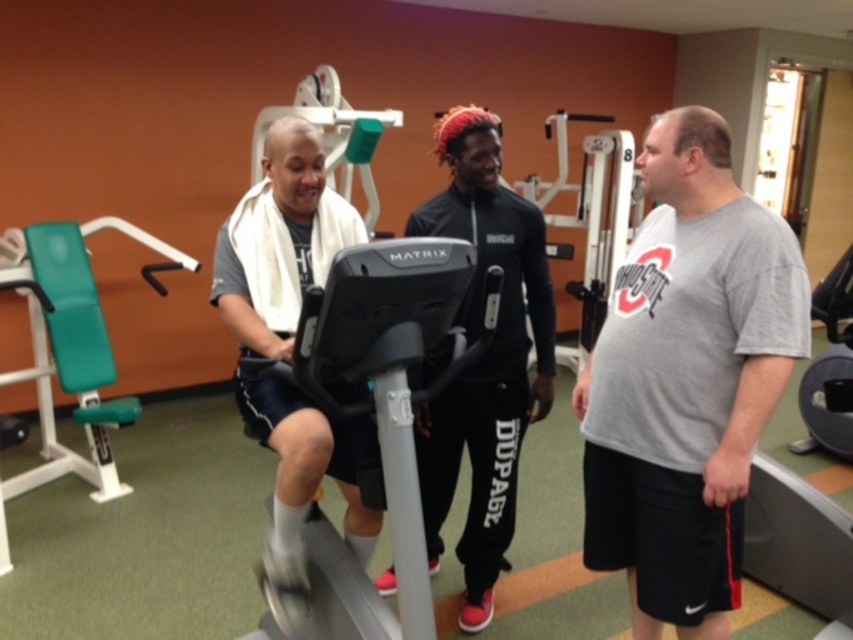
Can you confirm if black plastic elliptical at center is positioned to the left of gray matte/soft exercise bike at center?

Incorrect, black plastic elliptical at center is not on the left side of gray matte/soft exercise bike at center.

Does black plastic elliptical at center have a larger size compared to gray matte/soft exercise bike at center?

Yes, black plastic elliptical at center is bigger than gray matte/soft exercise bike at center.

Is point (445, 316) behind point (242, 317)?

No.

The image size is (853, 640). In order to click on black plastic elliptical at center in this screenshot , I will do `click(376, 412)`.

Does black plastic elliptical at center appear over black matte track pants at center?

Actually, black plastic elliptical at center is below black matte track pants at center.

Does black plastic elliptical at center appear on the right side of black matte track pants at center?

In fact, black plastic elliptical at center is to the left of black matte track pants at center.

Describe the element at coordinates (376, 412) in the screenshot. I see `black plastic elliptical at center` at that location.

This screenshot has height=640, width=853. I want to click on black plastic elliptical at center, so (376, 412).

Is gray cotton t-shirt at center shorter than black plastic elliptical at center?

In fact, gray cotton t-shirt at center may be taller than black plastic elliptical at center.

Is gray cotton t-shirt at center taller than black plastic elliptical at center?

Correct, gray cotton t-shirt at center is much taller as black plastic elliptical at center.

Which is in front, point (675, 298) or point (442, 269)?

Positioned in front is point (442, 269).

At what (x,y) coordinates should I click in order to perform the action: click on gray cotton t-shirt at center. Please return your answer as a coordinate pair (x, y). This screenshot has height=640, width=853. Looking at the image, I should click on (686, 380).